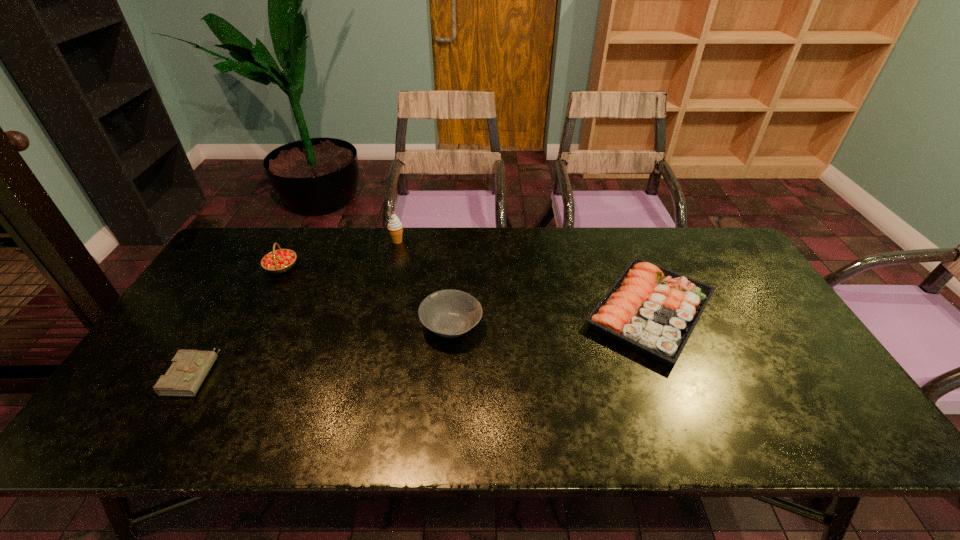
This screenshot has width=960, height=540. What are the coordinates of `vacant space situated 0.220m on the left of the third tallest object` in the screenshot? It's located at (340, 326).

The height and width of the screenshot is (540, 960). In order to click on blank space located 0.330m on the left of the fourth tallest object in this screenshot , I will do `click(464, 311)`.

Where is `blank space located on the right of the shortest object`? This screenshot has height=540, width=960. blank space located on the right of the shortest object is located at coordinates (273, 372).

Locate an element on the screen. icecream located in the far edge section of the desktop is located at coordinates (395, 226).

The height and width of the screenshot is (540, 960). I want to click on strawberry positioned at the far edge, so click(x=278, y=261).

Find the location of a particular element. platter present at the far edge is located at coordinates (651, 309).

Where is `strawberry present at the left edge`? The width and height of the screenshot is (960, 540). strawberry present at the left edge is located at coordinates (278, 261).

Where is `diary present at the left edge`? diary present at the left edge is located at coordinates (189, 368).

Find the location of a particular element. The height and width of the screenshot is (540, 960). object positioned at the right edge is located at coordinates (651, 309).

Identify the location of object located at the far left corner. (278, 261).